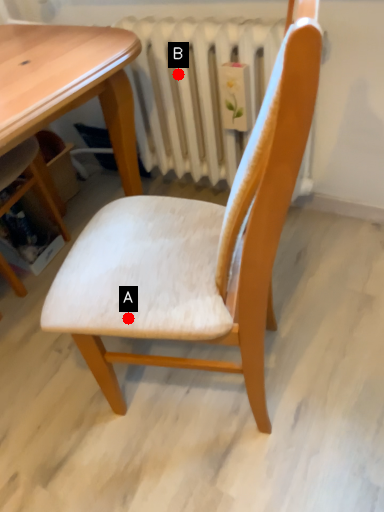
Question: Two points are circled on the image, labeled by A and B beside each circle. Which point is farther from the camera taking this photo?

Choices:
 (A) A is further
 (B) B is further

Answer: (B)